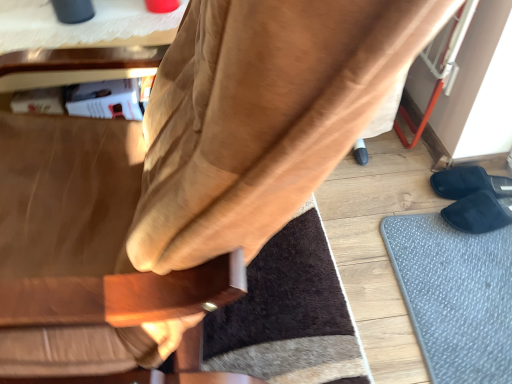
At what (x,y) coordinates should I click in order to perform the action: click on free space above gray textured bath mat at lower right (from a real-world perspective). Please return your answer as a coordinate pair (x, y). Looking at the image, I should click on (467, 276).